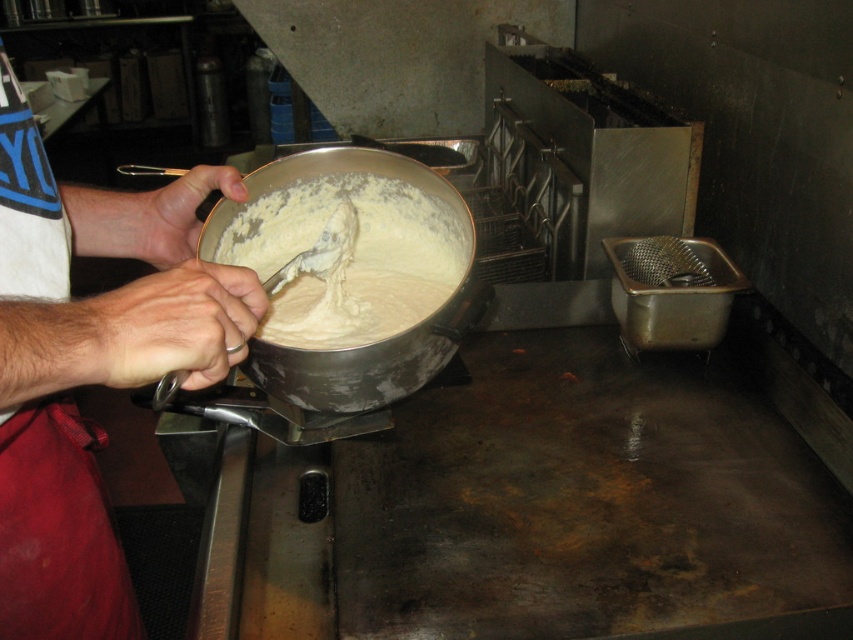
You are a chef in a commercial kitchen. You need to choose between the creamy matte pot at center and the matte silver spoon at upper center to store leftover batter. Which item is more suitable for this task and why?

The creamy matte pot at center is more suitable for storing leftover batter because it is larger in size than the matte silver spoon at upper center, providing enough space to hold the batter.

You are a chef in a commercial kitchen. You need to place a white matte bowl at upper left and a matte silver spoon at upper center onto a shelf that is 20 centimeters wide. Will both items fit side by side on the shelf without overlapping?

The white matte bowl at upper left and matte silver spoon at upper center are 21.51 centimeters apart from each other. Since the shelf is only 20 centimeters wide, they cannot fit side by side without overlapping.

You are a chef in a commercial kitchen and need to place both the white matte bowl at upper left and the matte silver spoon at upper center onto a shelf that can only hold items arranged vertically. Based on their positions in the image, which object should you place first to ensure they fit properly?

The white matte bowl at upper left should be placed first because it is positioned below the matte silver spoon at upper center in the image, indicating it requires more vertical space below it.